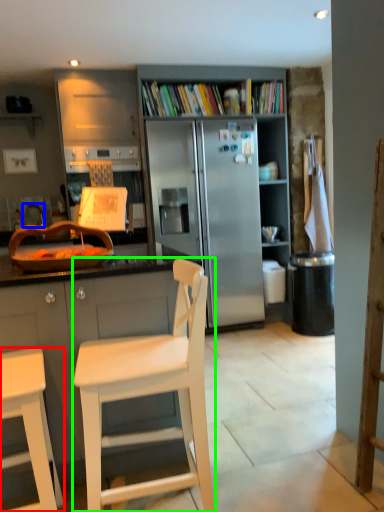
Question: Considering the real-world distances, which object is farthest from chair (highlighted by a red box)? faucet (highlighted by a blue box) or chair (highlighted by a green box)?

Choices:
 (A) faucet
 (B) chair

Answer: (A)